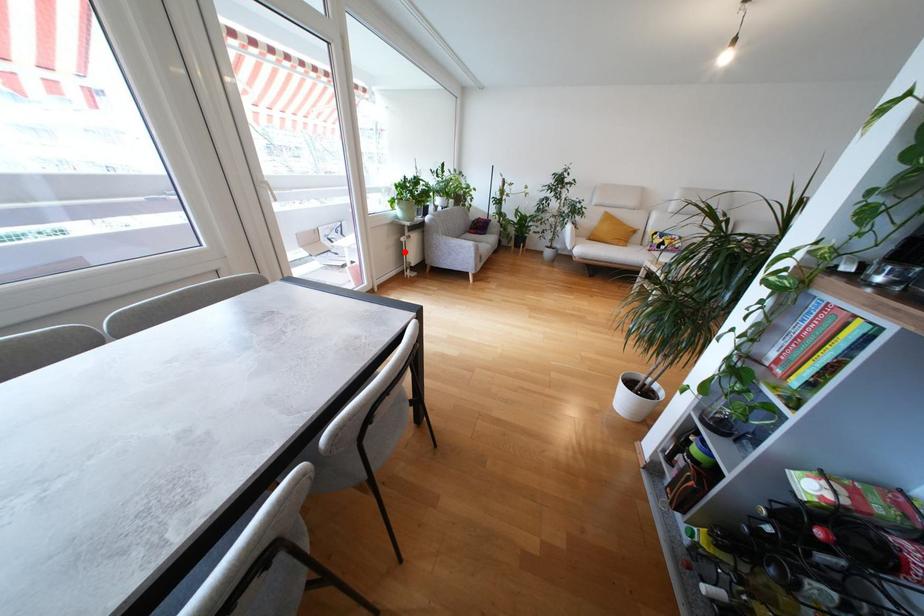
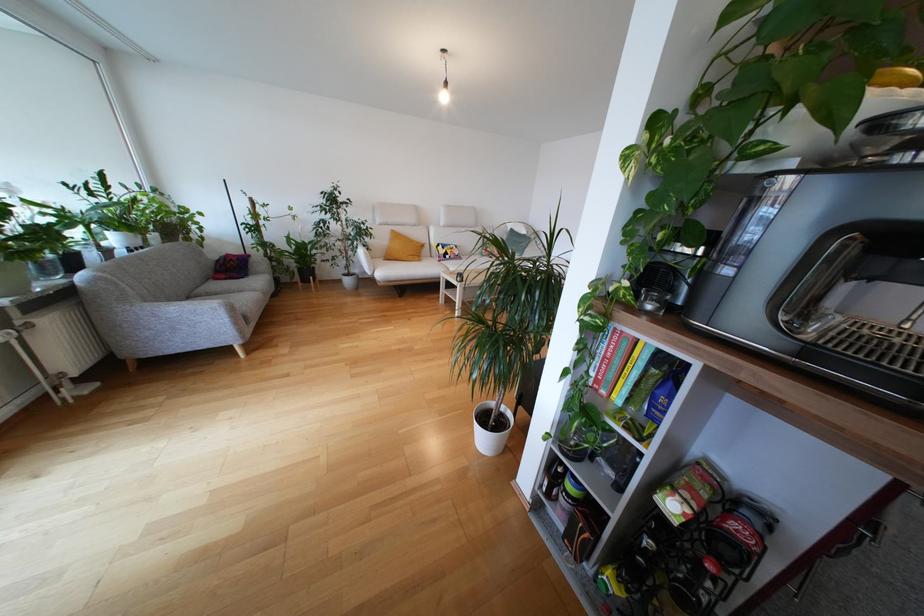
Question: I am providing you with two images of the same scene from different viewpoints. A red point is shown in image1. For the corresponding object point in image2, is it positioned nearer or farther from the camera?

Choices:
 (A) Nearer
 (B) Farther

Answer: (B)